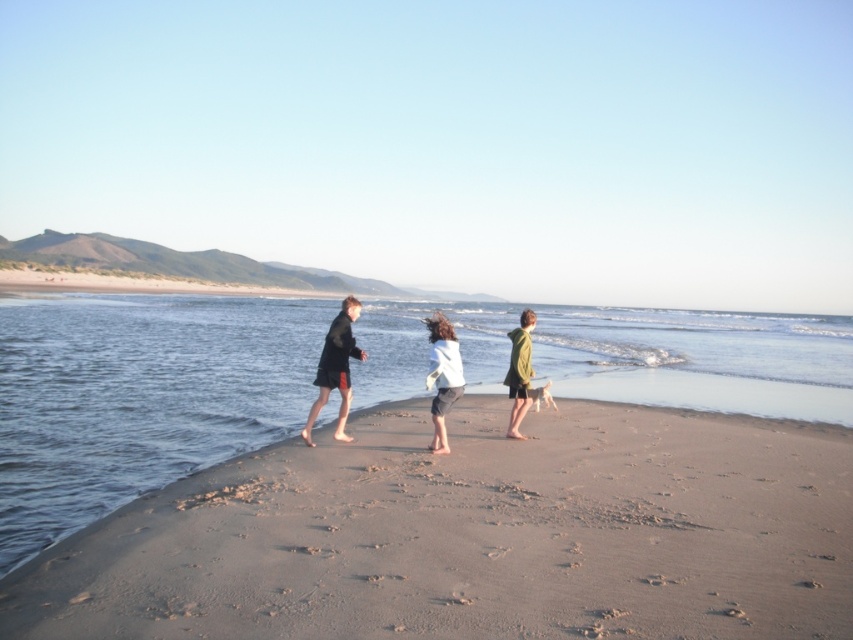
You are standing at the point labeled point [532,317] and want to walk towards the point labeled point [439,358]. Which direction should you face to move directly towards it?

You should face northeast to move directly towards point [439,358] from point [532,317].

You are a photographer trying to capture a photo of the two children wearing the dark matte coat at center and the green textured hoodie at center. Since you want to highlight their clothing, you need to ensure that the clothing items are clearly visible. Given the lighting conditions, which clothing item might be easier to see in the photo and why?

The dark matte coat at center has a greater height compared to the green textured hoodie at center, so it might be easier to see in the photo because its taller silhouette would stand out more against the background.